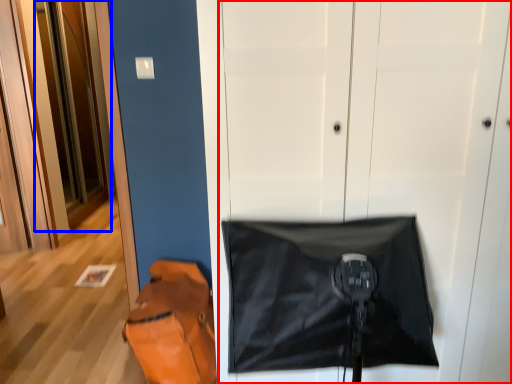
Question: Among these objects, which one is farthest to the camera, door (highlighted by a red box) or door (highlighted by a blue box)?

Choices:
 (A) door
 (B) door

Answer: (B)